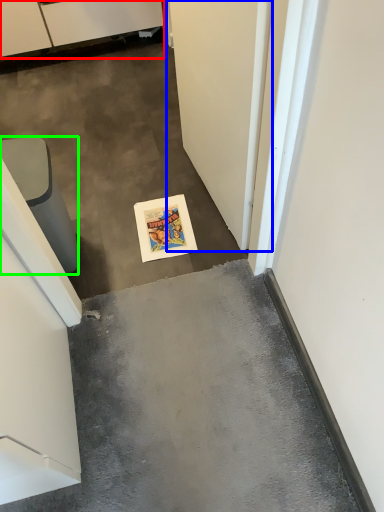
Question: Estimate the real-world distances between objects in this image. Which object is closer to cabinetry (highlighted by a red box), door (highlighted by a blue box) or furniture (highlighted by a green box)?

Choices:
 (A) door
 (B) furniture

Answer: (B)